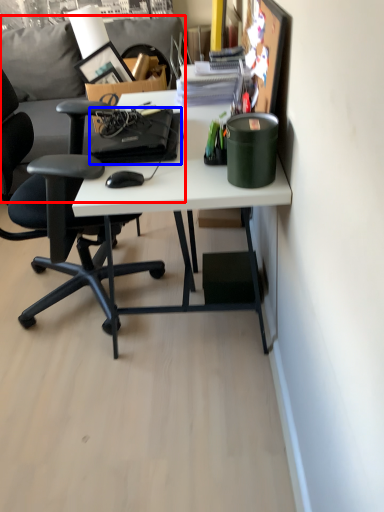
Question: Among these objects, which one is nearest to the camera, couch (highlighted by a red box) or laptop (highlighted by a blue box)?

Choices:
 (A) couch
 (B) laptop

Answer: (B)